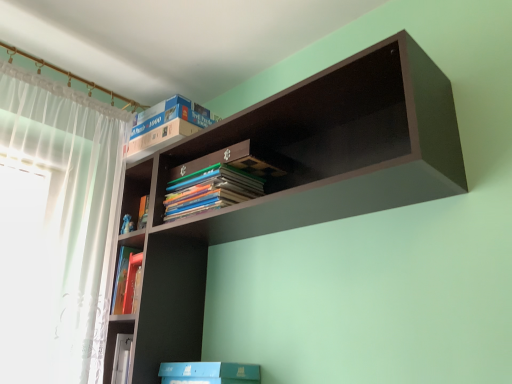
Consider the image. What is the approximate height of blue cardboard box at upper center?

blue cardboard box at upper center is 7.18 inches tall.

Describe the element at coordinates (166, 125) in the screenshot. I see `blue cardboard box at upper center` at that location.

Where is `blue cardboard box at upper center`? blue cardboard box at upper center is located at coordinates (166, 125).

You are a GUI agent. You are given a task and a screenshot of the screen. Output one action in this format:
    pyautogui.click(x=<x>, y=<y>)
    Task: Click on the dark wood shelf at upper center
    
    Given the screenshot: What is the action you would take?
    pyautogui.click(x=290, y=180)

What do you see at coordinates (290, 180) in the screenshot? I see `dark wood shelf at upper center` at bounding box center [290, 180].

This screenshot has width=512, height=384. In order to click on blue cardboard box at upper center in this screenshot , I will do `click(166, 125)`.

Considering the positions of objects blue cardboard box at upper center and dark wood shelf at upper center in the image provided, who is more to the left, blue cardboard box at upper center or dark wood shelf at upper center?

blue cardboard box at upper center.

Is blue cardboard box at upper center further to camera compared to dark wood shelf at upper center?

Yes, it is.

Does point (137, 126) come in front of point (348, 114)?

No, it is not.

From the image's perspective, does blue cardboard box at upper center appear higher than dark wood shelf at upper center?

Indeed, from the image's perspective, blue cardboard box at upper center is shown above dark wood shelf at upper center.

From a real-world perspective, is blue cardboard box at upper center physically below dark wood shelf at upper center?

Actually, blue cardboard box at upper center is physically above dark wood shelf at upper center in the real world.

Can you confirm if blue cardboard box at upper center is wider than dark wood shelf at upper center?

No, blue cardboard box at upper center is not wider than dark wood shelf at upper center.

Based on the photo, considering the sizes of objects blue cardboard box at upper center and dark wood shelf at upper center in the image provided, who is taller, blue cardboard box at upper center or dark wood shelf at upper center?

With more height is dark wood shelf at upper center.

Between blue cardboard box at upper center and dark wood shelf at upper center, which one has smaller size?

blue cardboard box at upper center is smaller.

Looking at this image, does blue cardboard box at upper center contain dark wood shelf at upper center?

No, dark wood shelf at upper center is not surrounded by blue cardboard box at upper center.

Is blue cardboard box at upper center not close to dark wood shelf at upper center?

No, blue cardboard box at upper center is not far from dark wood shelf at upper center.

Is blue cardboard box at upper center looking in the opposite direction of dark wood shelf at upper center?

No, dark wood shelf at upper center is not at the back of blue cardboard box at upper center.

Where is `shelf on the right of blue cardboard box at upper center`? The width and height of the screenshot is (512, 384). shelf on the right of blue cardboard box at upper center is located at coordinates (290, 180).

Considering the positions of objects dark wood shelf at upper center and blue cardboard box at upper center in the image provided, who is more to the left, dark wood shelf at upper center or blue cardboard box at upper center?

blue cardboard box at upper center.

Is the position of dark wood shelf at upper center more distant than that of blue cardboard box at upper center?

No, dark wood shelf at upper center is closer to the camera.

Which is behind, point (190, 329) or point (137, 130)?

Point (137, 130)

From the image's perspective, would you say dark wood shelf at upper center is shown under blue cardboard box at upper center?

Yes, from the image's perspective, dark wood shelf at upper center is below blue cardboard box at upper center.

From a real-world perspective, which is physically above, dark wood shelf at upper center or blue cardboard box at upper center?

blue cardboard box at upper center is physically above.

Which of these two, dark wood shelf at upper center or blue cardboard box at upper center, is thinner?

blue cardboard box at upper center.

Consider the image. Is dark wood shelf at upper center taller than blue cardboard box at upper center?

Yes.

Which of these two, dark wood shelf at upper center or blue cardboard box at upper center, is smaller?

Smaller between the two is blue cardboard box at upper center.

Do you think dark wood shelf at upper center is within blue cardboard box at upper center, or outside of it?

The correct answer is: outside.

Are dark wood shelf at upper center and blue cardboard box at upper center making contact?

dark wood shelf at upper center and blue cardboard box at upper center are clearly separated.

Could you tell me if dark wood shelf at upper center is facing blue cardboard box at upper center?

No, dark wood shelf at upper center is not oriented towards blue cardboard box at upper center.

What's the angular difference between dark wood shelf at upper center and blue cardboard box at upper center's facing directions?

The angle between the facing direction of dark wood shelf at upper center and the facing direction of blue cardboard box at upper center is 0.703 degrees.

How far apart are dark wood shelf at upper center and blue cardboard box at upper center?

The distance of dark wood shelf at upper center from blue cardboard box at upper center is 15.31 inches.

The image size is (512, 384). In order to click on shelf in front of the blue cardboard box at upper center in this screenshot , I will do `click(290, 180)`.

The width and height of the screenshot is (512, 384). Identify the location of shelf below the blue cardboard box at upper center (from a real-world perspective). (290, 180).

You are a GUI agent. You are given a task and a screenshot of the screen. Output one action in this format:
    pyautogui.click(x=<x>, y=<y>)
    Task: Click on the book above the dark wood shelf at upper center (from the image's perspective)
    This screenshot has width=512, height=384.
    Given the screenshot: What is the action you would take?
    pyautogui.click(x=166, y=125)